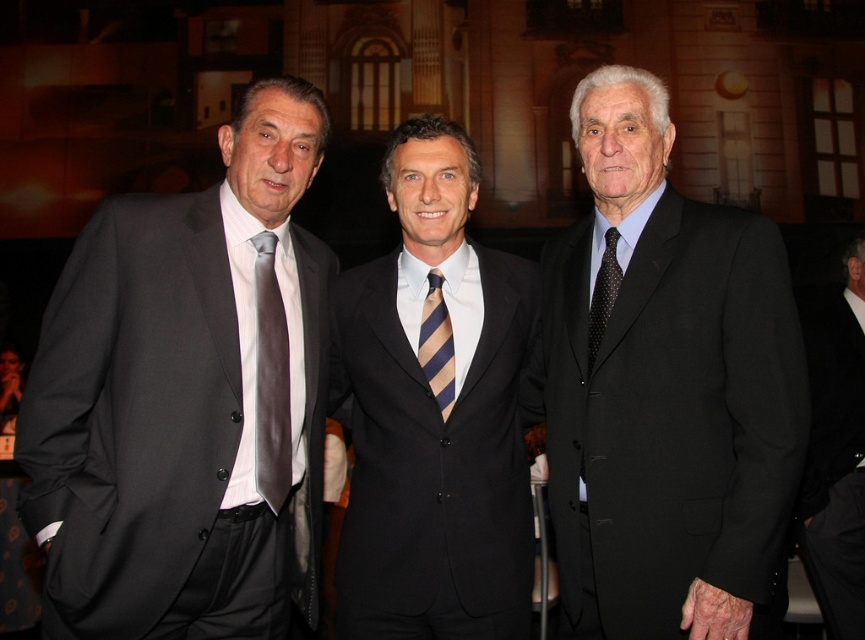
Question: Observing the image, what is the correct spatial positioning of matte gray tie at left in reference to striped fabric tie at center?

Choices:
 (A) above
 (B) below

Answer: (B)

Question: Which of the following is the farthest from the observer?

Choices:
 (A) matte black suit at left
 (B) black textured suit at right

Answer: (A)

Question: Which object is closer to the camera taking this photo?

Choices:
 (A) black matte suit at right
 (B) matte gray tie at left

Answer: (B)

Question: Is black matte suit at right positioned behind matte gray tie at left?

Choices:
 (A) no
 (B) yes

Answer: (B)

Question: Which object is the closest to the striped fabric tie at center?

Choices:
 (A) black matte suit at right
 (B) black textured suit at right

Answer: (B)

Question: Can you confirm if matte black suit at left is thinner than black matte suit at right?

Choices:
 (A) no
 (B) yes

Answer: (A)